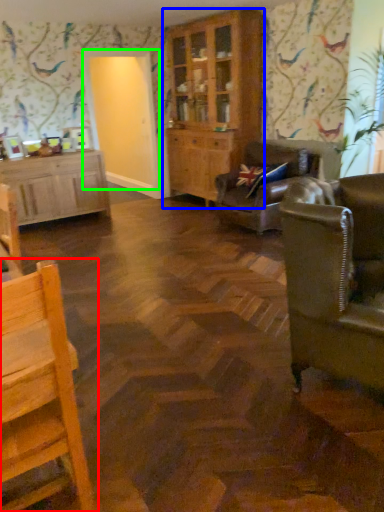
Question: Considering the real-world distances, which object is farthest from chair (highlighted by a red box)? cabinetry (highlighted by a blue box) or glass door (highlighted by a green box)?

Choices:
 (A) cabinetry
 (B) glass door

Answer: (B)